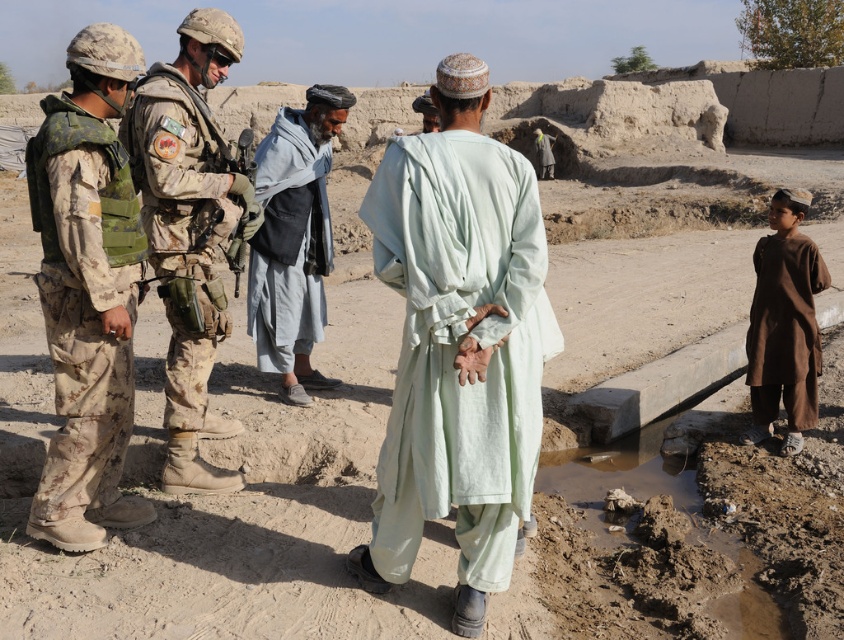
Does camouflage fabric robe at left appear on the right side of light blue fabric at center?

In fact, camouflage fabric robe at left is to the left of light blue fabric at center.

Between point (115, 401) and point (307, 304), which one is positioned in front?

Point (115, 401) is more forward.

The image size is (844, 640). In order to click on camouflage fabric robe at left in this screenshot , I will do `click(84, 305)`.

Find the location of a particular element. This screenshot has height=640, width=844. camouflage fabric robe at left is located at coordinates (84, 305).

Which is in front, point (415, 376) or point (290, 236)?

Point (415, 376) is more forward.

Measure the distance from light green fabric at center to light blue fabric at center.

light green fabric at center and light blue fabric at center are 2.12 meters apart from each other.

Who is more distant from viewer, (471, 401) or (282, 125)?

The point (282, 125) is behind.

Identify the location of light green fabric at center. (458, 344).

Does camouflage fabric robe at left appear on the right side of camouflage fabric uniform at center?

Incorrect, camouflage fabric robe at left is not on the right side of camouflage fabric uniform at center.

Is point (90, 188) positioned after point (191, 401)?

That is False.

The image size is (844, 640). What are the coordinates of `camouflage fabric robe at left` in the screenshot? It's located at (84, 305).